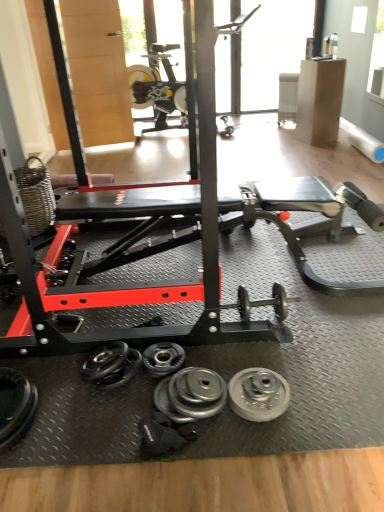
Question: Does silver metallic dumbbell at lower left, arranged as the first dumbbell when viewed from the left, have a greater height compared to silver metallic dumbbell at center, acting as the third dumbbell starting from the left?

Choices:
 (A) no
 (B) yes

Answer: (B)

Question: Is the depth of silver metallic dumbbell at lower left, arranged as the first dumbbell when viewed from the left, greater than that of silver metallic dumbbell at center, which is the first dumbbell from right to left?

Choices:
 (A) no
 (B) yes

Answer: (A)

Question: Considering the relative positions of silver metallic dumbbell at lower left, the 3th dumbbell positioned from the right, and silver metallic dumbbell at center, acting as the third dumbbell starting from the left, in the image provided, is silver metallic dumbbell at lower left, the 3th dumbbell positioned from the right, to the right of silver metallic dumbbell at center, acting as the third dumbbell starting from the left, from the viewer's perspective?

Choices:
 (A) yes
 (B) no

Answer: (B)

Question: Is silver metallic dumbbell at lower left, the 3th dumbbell positioned from the right, facing towards silver metallic dumbbell at center, acting as the third dumbbell starting from the left?

Choices:
 (A) no
 (B) yes

Answer: (B)

Question: Does silver metallic dumbbell at lower left, arranged as the first dumbbell when viewed from the left, have a greater width compared to silver metallic dumbbell at center, acting as the third dumbbell starting from the left?

Choices:
 (A) yes
 (B) no

Answer: (A)

Question: Would you say silver metallic dumbbell at center, which is the first dumbbell from right to left, is inside or outside silver metallic dumbbell at center, marked as the 2th dumbbell in a right-to-left arrangement?

Choices:
 (A) inside
 (B) outside

Answer: (B)

Question: Is silver metallic dumbbell at center, which is the first dumbbell from right to left, wider or thinner than silver metallic dumbbell at center, marked as the 2th dumbbell in a right-to-left arrangement?

Choices:
 (A) thin
 (B) wide

Answer: (B)

Question: Is silver metallic dumbbell at center, acting as the third dumbbell starting from the left, in front of or behind silver metallic dumbbell at center, the second dumbbell when ordered from left to right, in the image?

Choices:
 (A) behind
 (B) front

Answer: (B)

Question: From the image's perspective, is silver metallic dumbbell at center, which is the first dumbbell from right to left, located above or below silver metallic dumbbell at center, marked as the 2th dumbbell in a right-to-left arrangement?

Choices:
 (A) above
 (B) below

Answer: (B)

Question: From a real-world perspective, is silver metallic dumbbell at center, marked as the 2th dumbbell in a right-to-left arrangement, positioned above or below silver metallic weight at center, which is the first wheel in left-to-right order?

Choices:
 (A) below
 (B) above

Answer: (B)

Question: Is point (162, 356) closer or farther from the camera than point (187, 419)?

Choices:
 (A) farther
 (B) closer

Answer: (A)

Question: Looking at their shapes, would you say silver metallic dumbbell at center, the second dumbbell when ordered from left to right, is wider or thinner than silver metallic weight at center, which is the first wheel in left-to-right order?

Choices:
 (A) thin
 (B) wide

Answer: (A)

Question: Would you say silver metallic dumbbell at center, the second dumbbell when ordered from left to right, is to the left or to the right of silver metallic weight at center, marked as the second wheel in a right-to-left arrangement, in the picture?

Choices:
 (A) right
 (B) left

Answer: (B)

Question: From a real-world perspective, is transparent glass window at upper center physically located above or below silver metallic weight at center, marked as the second wheel in a right-to-left arrangement?

Choices:
 (A) below
 (B) above

Answer: (B)

Question: Choose the correct answer: Is transparent glass window at upper center inside silver metallic weight at center, which is the first wheel in left-to-right order, or outside it?

Choices:
 (A) inside
 (B) outside

Answer: (B)